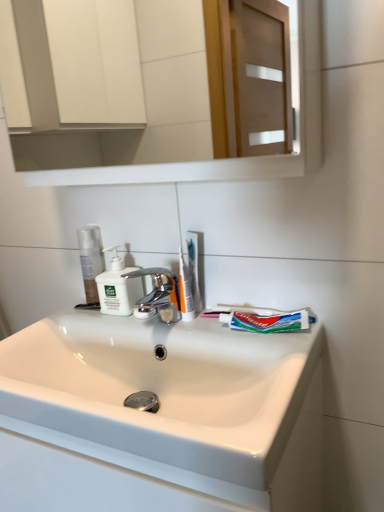
Find the location of a particular element. Image resolution: width=384 pixels, height=512 pixels. vacant space underneath white glossy mirror at upper center (from a real-world perspective) is located at coordinates (187, 330).